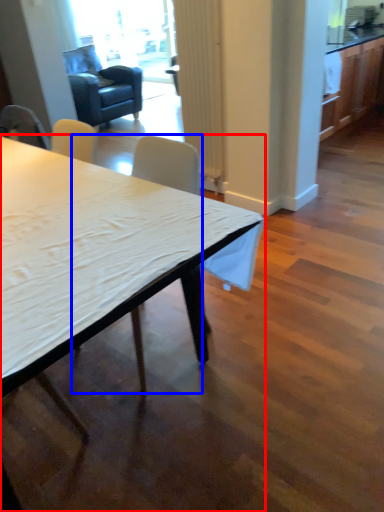
Question: Which object appears farthest to the camera in this image, desk (highlighted by a red box) or chair (highlighted by a blue box)?

Choices:
 (A) desk
 (B) chair

Answer: (B)